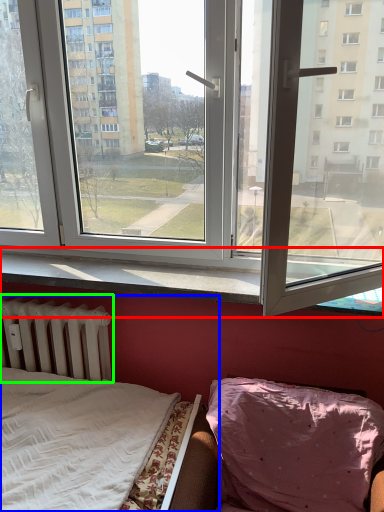
Question: Estimate the real-world distances between objects in this image. Which object is farther from window sill (highlighted by a red box), bed (highlighted by a blue box) or radiator (highlighted by a green box)?

Choices:
 (A) bed
 (B) radiator

Answer: (A)